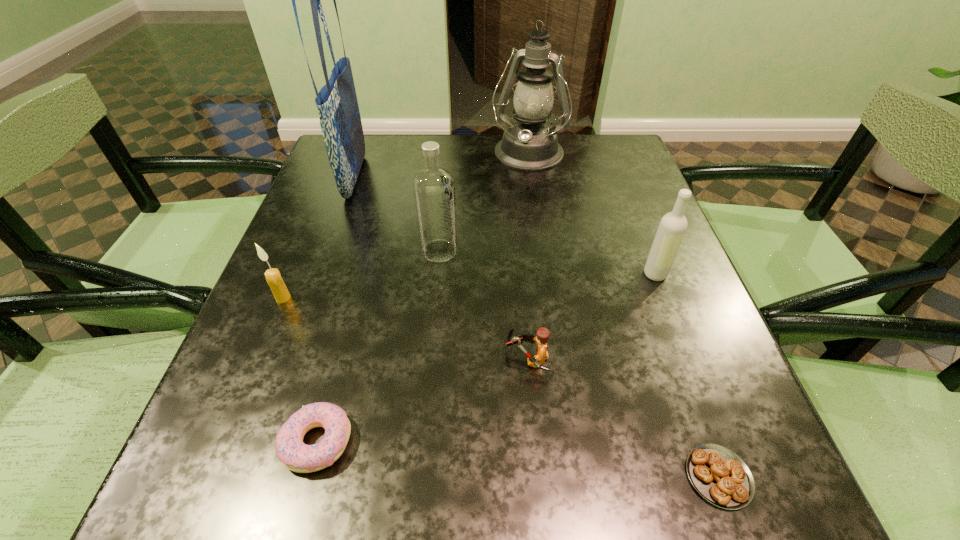
Find the location of a particular element. The image size is (960, 540). shopping bag is located at coordinates (340, 121).

Identify the location of the tallest object. Image resolution: width=960 pixels, height=540 pixels. (340, 121).

Where is `the second tallest object`? Image resolution: width=960 pixels, height=540 pixels. the second tallest object is located at coordinates (530, 144).

Where is `the taller vodka`? The height and width of the screenshot is (540, 960). the taller vodka is located at coordinates (434, 189).

Find the location of `the farther vodka`. the farther vodka is located at coordinates (434, 189).

Image resolution: width=960 pixels, height=540 pixels. I want to click on the fourth tallest object, so click(x=673, y=225).

Where is `the nearer vodka`? the nearer vodka is located at coordinates (673, 225).

I want to click on the leftmost object, so click(x=273, y=277).

You are a GUI agent. You are given a task and a screenshot of the screen. Output one action in this format:
    pyautogui.click(x=<x>, y=<y>)
    Task: Click on the candle
    Image resolution: width=960 pixels, height=540 pixels.
    Given the screenshot: What is the action you would take?
    pyautogui.click(x=273, y=277)

This screenshot has height=540, width=960. In order to click on Lego in this screenshot , I will do `click(542, 335)`.